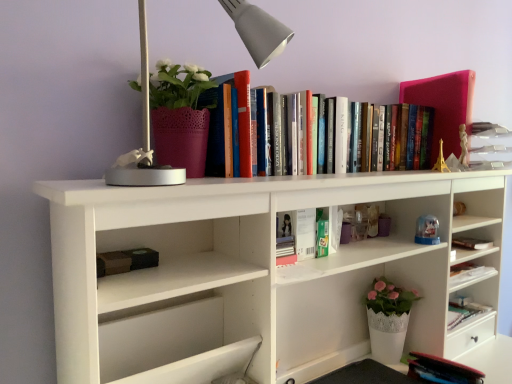
Question: In the image, is green matte book at center, marked as the second book in a bottom-to-top arrangement, on the left side or the right side of hardcover books at upper center, acting as the 3th book starting from the bottom?

Choices:
 (A) right
 (B) left

Answer: (B)

Question: In the image, is green matte book at center, which appears as the 2th book when viewed from the top, positioned in front of or behind hardcover books at upper center, marked as the first book in a top-to-bottom arrangement?

Choices:
 (A) behind
 (B) front

Answer: (A)

Question: Estimate the real-world distances between objects in this image. Which object is closer to the green matte book at center, which appears as the 2th book when viewed from the top?

Choices:
 (A) metallic gray table lamp at upper left
 (B) hardcover books at upper center, acting as the 3th book starting from the bottom
 (C) matte pink book at upper right
 (D) hardcover book at lower right, which ranks as the 3th book in top-to-bottom order
 (E) matte pink pot at upper left

Answer: (B)

Question: Estimate the real-world distances between objects in this image. Which object is farther from the green matte book at center, which appears as the 2th book when viewed from the top?

Choices:
 (A) metallic gray table lamp at upper left
 (B) hardcover books at upper center, marked as the first book in a top-to-bottom arrangement
 (C) hardcover book at lower right, which is counted as the 1th book, starting from the bottom
 (D) matte pink book at upper right
 (E) matte pink pot at upper left

Answer: (C)